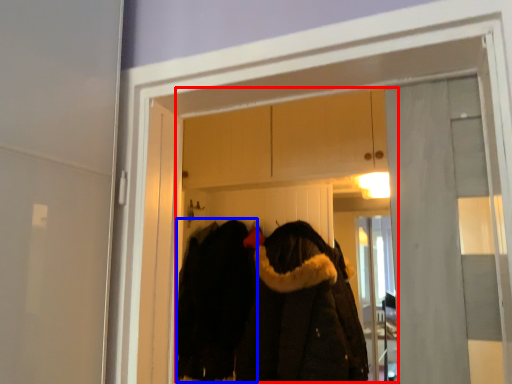
Question: Which point is further to the camera, clothing store (highlighted by a red box) or cloak (highlighted by a blue box)?

Choices:
 (A) clothing store
 (B) cloak

Answer: (B)